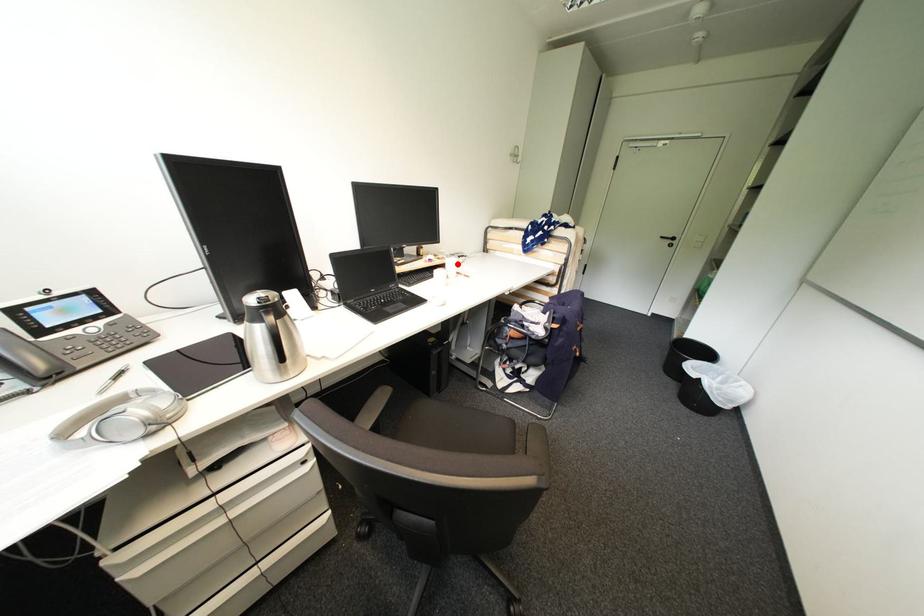
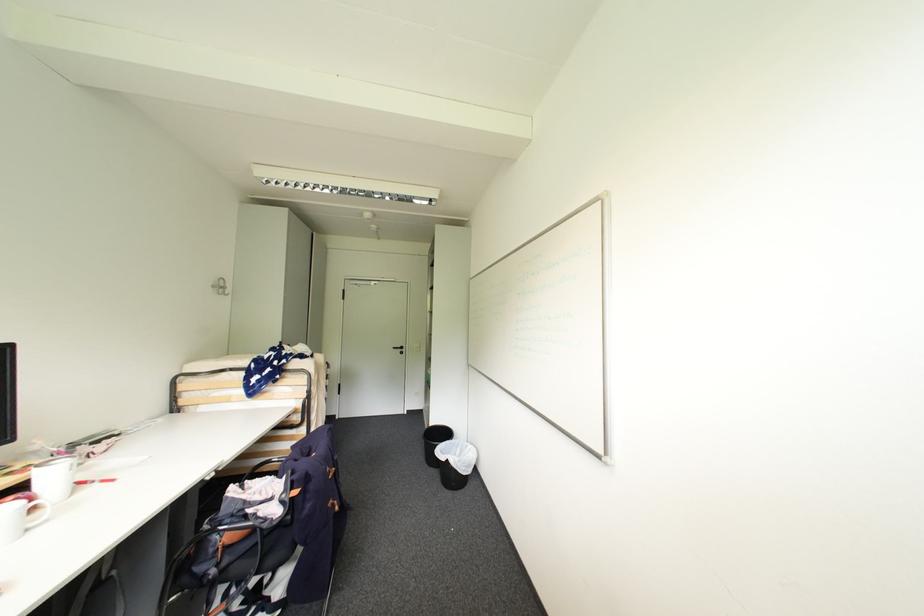
Locate, in the second image, the point that corresponds to the highlighted location in the first image.

(58, 475)